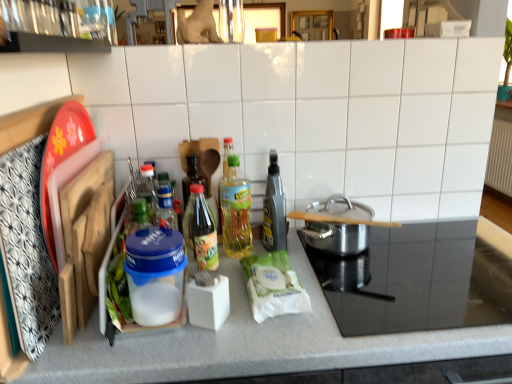
What do you see at coordinates (155, 274) in the screenshot? I see `blue plastic container at center-left, the second appliance when ordered from right to left` at bounding box center [155, 274].

The height and width of the screenshot is (384, 512). What do you see at coordinates (201, 230) in the screenshot? I see `green glass bottle at center, which is counted as the first bottle, starting from the left` at bounding box center [201, 230].

What do you see at coordinates (274, 208) in the screenshot? This screenshot has height=384, width=512. I see `metallic gray spray bottle at center, positioned as the 1th bottle in right-to-left order` at bounding box center [274, 208].

Consider the image. In order to face translucent plastic bottle at center, acting as the second bottle starting from the right, should I rotate leftwards or rightwards?

You should look left and rotate roughly 2.623 degrees.

Identify the location of blue plastic container at center-left, the second appliance when ordered from right to left. This screenshot has height=384, width=512. (155, 274).

Is white matte countertop at center inside blue plastic container at center-left, the second appliance when ordered from right to left?

No, white matte countertop at center is not inside blue plastic container at center-left, the second appliance when ordered from right to left.

Which object is positioned more to the right, blue plastic container at center-left, positioned as the first appliance in left-to-right order, or white matte countertop at center?

white matte countertop at center.

Which of these two, blue plastic container at center-left, the second appliance when ordered from right to left, or white matte countertop at center, is bigger?

Bigger between the two is white matte countertop at center.

Can you confirm if blue plastic container at center-left, positioned as the first appliance in left-to-right order, is shorter than white matte countertop at center?

Indeed, blue plastic container at center-left, positioned as the first appliance in left-to-right order, has a lesser height compared to white matte countertop at center.

In terms of width, does green glass bottle at center, which is counted as the first bottle, starting from the left, look wider or thinner when compared to blue plastic container at center-left, the second appliance when ordered from right to left?

green glass bottle at center, which is counted as the first bottle, starting from the left, is wider than blue plastic container at center-left, the second appliance when ordered from right to left.

Which of these two, green glass bottle at center, which is counted as the first bottle, starting from the left, or blue plastic container at center-left, the second appliance when ordered from right to left, is smaller?

With smaller size is green glass bottle at center, which is counted as the first bottle, starting from the left.

From the image's perspective, which one is positioned lower, green glass bottle at center, which is counted as the first bottle, starting from the left, or blue plastic container at center-left, the second appliance when ordered from right to left?

blue plastic container at center-left, the second appliance when ordered from right to left, is shown below in the image.

Does green glass bottle at center, the 3th bottle viewed from the right, lie behind blue plastic container at center-left, positioned as the first appliance in left-to-right order?

Yes, green glass bottle at center, the 3th bottle viewed from the right, is further from the camera.

Is stainless steel pot at right, the second appliance in the left-to-right sequence, next to white matte countertop at center?

No, stainless steel pot at right, the second appliance in the left-to-right sequence, is not in contact with white matte countertop at center.

Does stainless steel pot at right, placed as the first appliance when sorted from right to left, turn towards white matte countertop at center?

Yes, stainless steel pot at right, placed as the first appliance when sorted from right to left, is facing white matte countertop at center.

What's the angular difference between stainless steel pot at right, placed as the first appliance when sorted from right to left, and white matte countertop at center's facing directions?

They differ by 0.000131 degrees in their facing directions.

Identify the location of countertop directly beneath the stainless steel pot at right, placed as the first appliance when sorted from right to left (from a real-world perspective). (324, 342).

Consider the image. Can you tell me how much white matte paper towel at center and translucent plastic bottle at center, acting as the second bottle starting from the right, differ in facing direction?

There is a 5.18-degree angle between the facing directions of white matte paper towel at center and translucent plastic bottle at center, acting as the second bottle starting from the right.

Considering the positions of objects white matte paper towel at center and translucent plastic bottle at center, acting as the second bottle starting from the right, in the image provided, who is more to the right, white matte paper towel at center or translucent plastic bottle at center, acting as the second bottle starting from the right,?

white matte paper towel at center.

From the image's perspective, is white matte paper towel at center on top of translucent plastic bottle at center, acting as the second bottle starting from the right?

Incorrect, from the image's perspective, white matte paper towel at center is lower than translucent plastic bottle at center, acting as the second bottle starting from the right.

Can you see white matte paper towel at center touching translucent plastic bottle at center, the 2th bottle from the left?

white matte paper towel at center is not next to translucent plastic bottle at center, the 2th bottle from the left, and they're not touching.

How many degrees apart are the facing directions of stainless steel pot at right, placed as the first appliance when sorted from right to left, and blue plastic container at center-left, the second appliance when ordered from right to left?

There is a 2.43-degree angle between the facing directions of stainless steel pot at right, placed as the first appliance when sorted from right to left, and blue plastic container at center-left, the second appliance when ordered from right to left.

From a real-world perspective, is stainless steel pot at right, placed as the first appliance when sorted from right to left, below blue plastic container at center-left, positioned as the first appliance in left-to-right order?

Yes, from a real-world perspective, stainless steel pot at right, placed as the first appliance when sorted from right to left, is beneath blue plastic container at center-left, positioned as the first appliance in left-to-right order.

Which object is further away from the camera, stainless steel pot at right, the second appliance in the left-to-right sequence, or blue plastic container at center-left, positioned as the first appliance in left-to-right order?

blue plastic container at center-left, positioned as the first appliance in left-to-right order, is more distant.

Which is correct: stainless steel pot at right, the second appliance in the left-to-right sequence, is inside blue plastic container at center-left, the second appliance when ordered from right to left, or outside of it?

stainless steel pot at right, the second appliance in the left-to-right sequence, exists outside the volume of blue plastic container at center-left, the second appliance when ordered from right to left.

Is stainless steel pot at right, the second appliance in the left-to-right sequence, facing away from white matte paper towel at center?

stainless steel pot at right, the second appliance in the left-to-right sequence, does not have its back to white matte paper towel at center.

Would you say stainless steel pot at right, the second appliance in the left-to-right sequence, is to the left or to the right of white matte paper towel at center in the picture?

stainless steel pot at right, the second appliance in the left-to-right sequence, is to the right of white matte paper towel at center.

Considering the sizes of stainless steel pot at right, placed as the first appliance when sorted from right to left, and white matte paper towel at center in the image, is stainless steel pot at right, placed as the first appliance when sorted from right to left, taller or shorter than white matte paper towel at center?

In the image, stainless steel pot at right, placed as the first appliance when sorted from right to left, appears to be shorter than white matte paper towel at center.

In the scene shown: Measure the distance between stainless steel pot at right, placed as the first appliance when sorted from right to left, and white matte paper towel at center.

stainless steel pot at right, placed as the first appliance when sorted from right to left, is 8.99 inches from white matte paper towel at center.

From the picture: From the image's perspective, who appears lower, polished stainless steel pot at center right or white matte paper towel at center?

white matte paper towel at center appears lower in the image.

Is polished stainless steel pot at center right further to the viewer compared to white matte paper towel at center?

Yes, polished stainless steel pot at center right is further from the camera.

Find the location of a particular element. kitchen appliance above the white matte paper towel at center (from a real-world perspective) is located at coordinates (337, 237).

Is polished stainless steel pot at center right aimed at white matte paper towel at center?

No, polished stainless steel pot at center right does not turn towards white matte paper towel at center.

The width and height of the screenshot is (512, 384). In order to click on countertop located underneath the blue plastic container at center-left, the second appliance when ordered from right to left (from a real-world perspective) in this screenshot , I will do `click(324, 342)`.

Identify the location of appliance on the left of green glass bottle at center, which is counted as the first bottle, starting from the left. (155, 274).

Based on the photo, estimate the real-world distances between objects in this image. Which object is closer to stainless steel pot at right, the second appliance in the left-to-right sequence, metallic gray spray bottle at center, positioned as the 1th bottle in right-to-left order, or translucent plastic bottle at center, the 2th bottle from the left?

The object closer to stainless steel pot at right, the second appliance in the left-to-right sequence, is metallic gray spray bottle at center, positioned as the 1th bottle in right-to-left order.

Looking at the image, which one is located further to metallic gray spray bottle at center, which is the 3th bottle in left-to-right order, translucent plastic bottle at center, acting as the second bottle starting from the right, or white matte countertop at center?

Based on the image, white matte countertop at center appears to be further to metallic gray spray bottle at center, which is the 3th bottle in left-to-right order.

From the image, which object appears to be farther from stainless steel pot at right, the second appliance in the left-to-right sequence, white matte countertop at center or translucent plastic bottle at center, acting as the second bottle starting from the right?

translucent plastic bottle at center, acting as the second bottle starting from the right, is positioned further to the anchor stainless steel pot at right, the second appliance in the left-to-right sequence.

Looking at this image, looking at the image, which one is located further to white matte paper towel at center, polished stainless steel pot at center right or translucent plastic bottle at center, the 2th bottle from the left?

translucent plastic bottle at center, the 2th bottle from the left, is further to white matte paper towel at center.

From the image, which object appears to be nearer to translucent plastic bottle at center, acting as the second bottle starting from the right, white matte paper towel at center or blue plastic container at center-left, the second appliance when ordered from right to left?

white matte paper towel at center.

From the image, which object appears to be farther from translucent plastic bottle at center, the 2th bottle from the left, blue plastic container at center-left, the second appliance when ordered from right to left, or polished stainless steel pot at center right?

The object further to translucent plastic bottle at center, the 2th bottle from the left, is blue plastic container at center-left, the second appliance when ordered from right to left.

Which object lies further to the anchor point metallic gray spray bottle at center, positioned as the 1th bottle in right-to-left order, polished stainless steel pot at center right or stainless steel pot at right, placed as the first appliance when sorted from right to left?

The object further to metallic gray spray bottle at center, positioned as the 1th bottle in right-to-left order, is stainless steel pot at right, placed as the first appliance when sorted from right to left.

Considering their positions, is white matte countertop at center positioned further to metallic gray spray bottle at center, positioned as the 1th bottle in right-to-left order, than green glass bottle at center, the 3th bottle viewed from the right?

The object further to metallic gray spray bottle at center, positioned as the 1th bottle in right-to-left order, is white matte countertop at center.

Locate an element on the screen. food located between blue plastic container at center-left, positioned as the first appliance in left-to-right order, and polished stainless steel pot at center right in the left-right direction is located at coordinates 273,286.

Find the location of `kitchen appliance between blue plastic container at center-left, the second appliance when ordered from right to left, and stainless steel pot at right, placed as the first appliance when sorted from right to left, from left to right`. kitchen appliance between blue plastic container at center-left, the second appliance when ordered from right to left, and stainless steel pot at right, placed as the first appliance when sorted from right to left, from left to right is located at coordinates (337, 237).

Identify the location of food between green glass bottle at center, the 3th bottle viewed from the right, and white matte countertop at center vertically. This screenshot has height=384, width=512. (273, 286).

I want to click on bottle between translucent plastic bottle at center, acting as the second bottle starting from the right, and stainless steel pot at right, placed as the first appliance when sorted from right to left, so click(x=274, y=208).